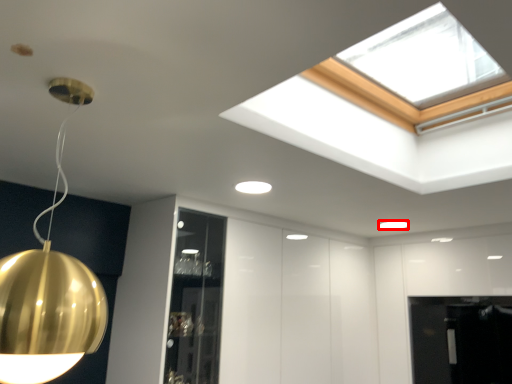
Question: In this image, where is lamp (annotated by the red box) located relative to lamp?

Choices:
 (A) right
 (B) left

Answer: (A)